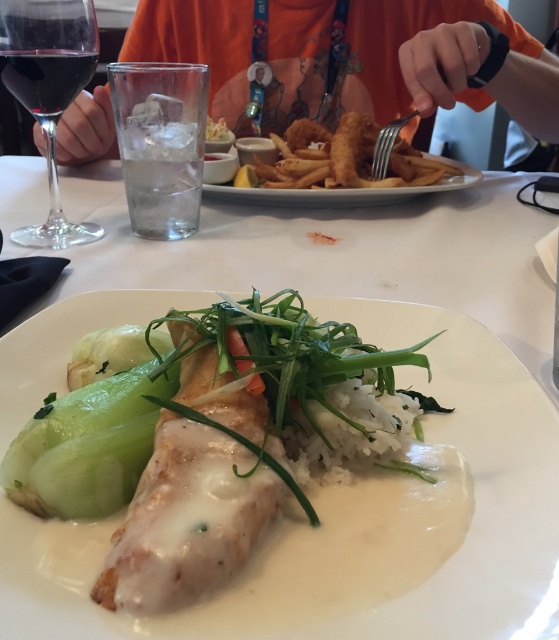
You are a waiter standing at the edge of the table. You need to deliver a drink to the transparent glass at upper left. The drink you are holding is 8 inches in diameter. Can you place the drink on the table without spilling it? Please explain your reasoning.

The transparent glass at upper left and viewer are 20.94 inches apart from each other. Since the drink is 8 inches in diameter, you can safely place it on the table as long as there is enough space around the transparent glass at upper left to accommodate the drink without causing any obstruction or spillage.

You are a waiter holding a tray and need to place a drink between the orange cotton shirt at upper center and the silver metallic fork at upper center. Can you fit the drink there?

The distance between the orange cotton shirt at upper center and the silver metallic fork at upper center is 10.09 inches, so yes, the drink can be placed there as there is sufficient space between them.

You are a waiter at the restaurant and you see the orange cotton shirt at upper center and the silver metallic fork at upper center on the table. Which object is closer to the edge of the table?

The silver metallic fork at upper center is closer to the edge of the table because it is shorter than the orange cotton shirt at upper center.